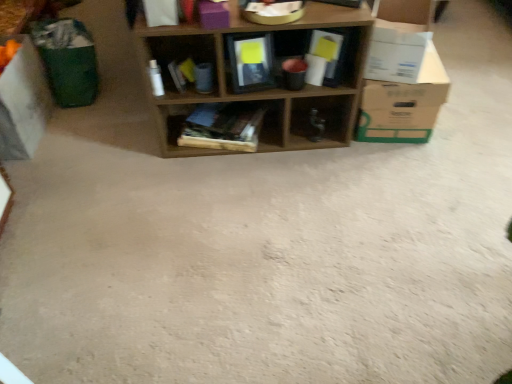
Question: Is white cardboard box at right, which is counted as the first cardboard box, starting from the right, turned away from white cardboard box at left, acting as the 3th cardboard box starting from the right?

Choices:
 (A) no
 (B) yes

Answer: (B)

Question: Is white cardboard box at right, which is counted as the first cardboard box, starting from the right, to the right of white cardboard box at left, acting as the 3th cardboard box starting from the right, from the viewer's perspective?

Choices:
 (A) yes
 (B) no

Answer: (A)

Question: Does white cardboard box at right, which is counted as the first cardboard box, starting from the right, turn towards white cardboard box at left, placed as the 1th cardboard box when sorted from left to right?

Choices:
 (A) yes
 (B) no

Answer: (B)

Question: Does white cardboard box at right, which is counted as the first cardboard box, starting from the right, have a greater height compared to white cardboard box at left, placed as the 1th cardboard box when sorted from left to right?

Choices:
 (A) no
 (B) yes

Answer: (A)

Question: Is white cardboard box at right, which is counted as the first cardboard box, starting from the right, not close to white cardboard box at left, acting as the 3th cardboard box starting from the right?

Choices:
 (A) yes
 (B) no

Answer: (A)

Question: Is white cardboard box at right, which is counted as the first cardboard box, starting from the right, shorter than white cardboard box at left, placed as the 1th cardboard box when sorted from left to right?

Choices:
 (A) yes
 (B) no

Answer: (A)

Question: Is white cardboard box at right, the 2th cardboard box from the left, positioned beyond the bounds of white cardboard box at left, acting as the 3th cardboard box starting from the right?

Choices:
 (A) yes
 (B) no

Answer: (A)

Question: From a real-world perspective, is white cardboard box at right, the 2th cardboard box from the left, under white cardboard box at left, placed as the 1th cardboard box when sorted from left to right?

Choices:
 (A) yes
 (B) no

Answer: (B)

Question: Does white cardboard box at right, the 2th cardboard box from the left, appear on the right side of white cardboard box at left, acting as the 3th cardboard box starting from the right?

Choices:
 (A) yes
 (B) no

Answer: (A)

Question: Does white cardboard box at right, the 2th cardboard box from the left, have a larger size compared to white cardboard box at left, acting as the 3th cardboard box starting from the right?

Choices:
 (A) yes
 (B) no

Answer: (B)

Question: Would you consider white cardboard box at right, the 2th cardboard box when ordered from right to left, to be distant from white cardboard box at left, placed as the 1th cardboard box when sorted from left to right?

Choices:
 (A) yes
 (B) no

Answer: (A)

Question: From the image's perspective, is white cardboard box at right, the 2th cardboard box when ordered from right to left, above white cardboard box at left, placed as the 1th cardboard box when sorted from left to right?

Choices:
 (A) yes
 (B) no

Answer: (A)

Question: Is white cardboard box at right, the 2th cardboard box when ordered from right to left, taller than wooden books at center, placed as the 2th shelf when sorted from left to right?

Choices:
 (A) no
 (B) yes

Answer: (B)